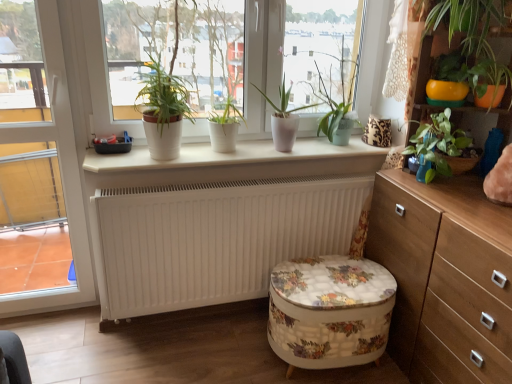
Where is `vacant area on top of floral fabric ottoman at center (from a real-world perspective)`? vacant area on top of floral fabric ottoman at center (from a real-world perspective) is located at coordinates (334, 280).